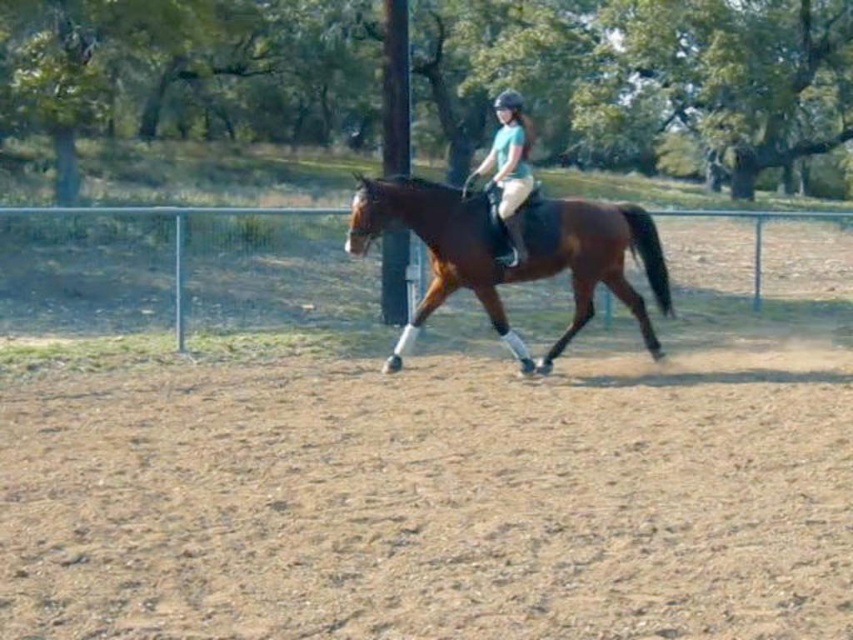
You are a photographer setting up a shot of the rider and horse in the arena. You want to ensure both the brown sandy ground at lower center and the green wire fence at center are visible. Which object should you focus on first to capture both in the frame?

The brown sandy ground at lower center is smaller than the green wire fence at center, so you should focus on the green wire fence at center first to ensure it fits in the frame while still capturing the smaller brown sandy ground at lower center.

You are a photographer positioned at the edge of the arena. You want to capture a photo of the matte green shirt at center without the green wire fence at center appearing in the foreground. Is this possible based on their positions?

The green wire fence at center is further to the viewer than the matte green shirt at center, so the fence would block the shirt in the foreground. Therefore, it is not possible to capture the matte green shirt at center without the green wire fence at center appearing in the foreground.